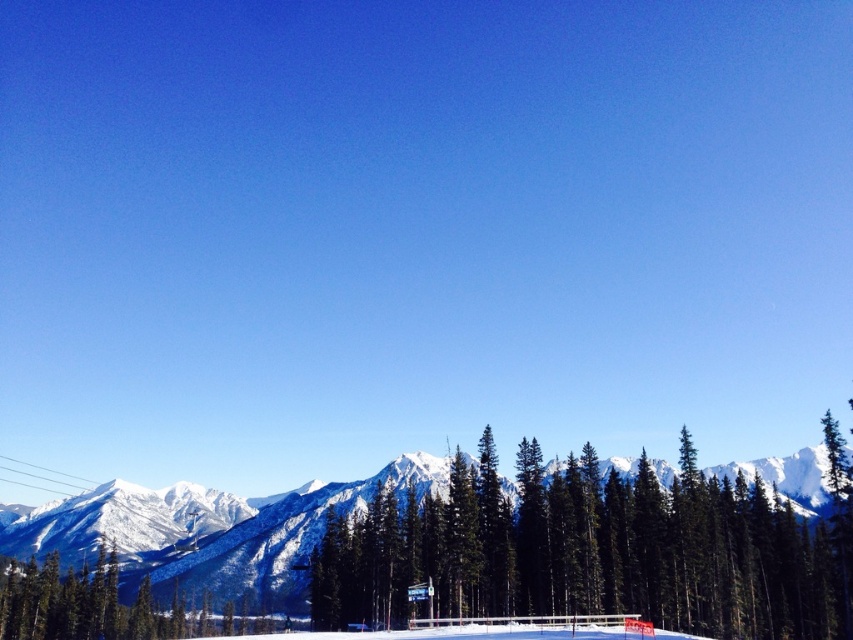
Between green matte tree at center and green matte tree at lower left, which one is positioned higher?

Positioned higher is green matte tree at center.

Describe the element at coordinates (595, 550) in the screenshot. I see `green matte tree at center` at that location.

The image size is (853, 640). In order to click on green matte tree at center in this screenshot , I will do `click(595, 550)`.

The width and height of the screenshot is (853, 640). I want to click on green matte tree at center, so click(595, 550).